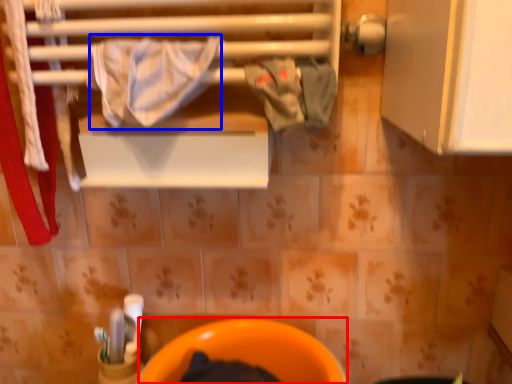
Question: Which point is closer to the camera, toilet bowl (highlighted by a red box) or bath towel (highlighted by a blue box)?

Choices:
 (A) toilet bowl
 (B) bath towel

Answer: (B)